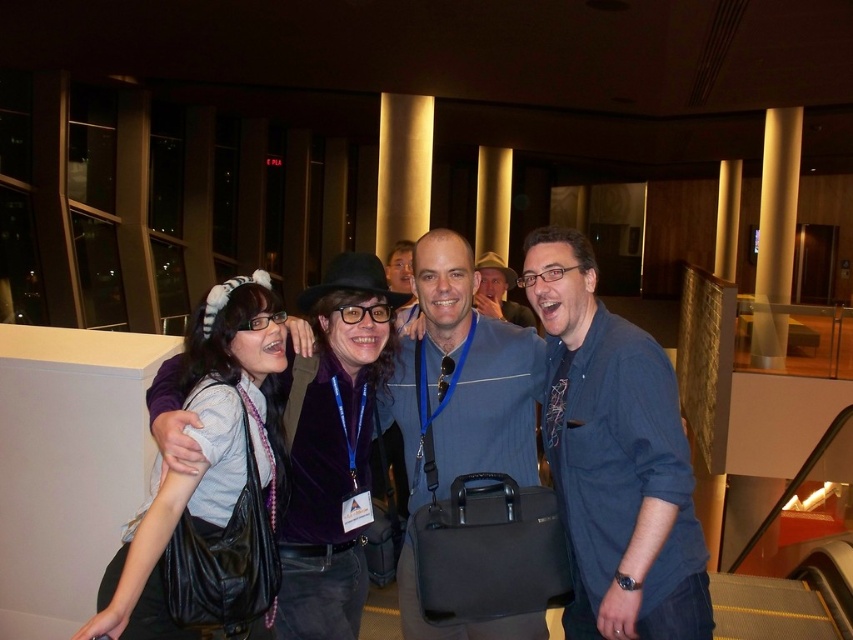
You are organizing a photo shoot and need to ensure that the matte black purse at center and the matte blue shirt at center are visible in the frame. Given their sizes, which object should you prioritize positioning closer to the camera to ensure clarity?

The matte black purse at center has a lesser width compared to the matte blue shirt at center, so you should prioritize positioning the matte black purse at center closer to the camera to ensure its details are clearly visible.

From the picture: You are organizing a small event and need to place two items on a narrow table. You have a matte black purse at center and a black leather bag at center. Which item should you choose to ensure it fits better on the table?

The matte black purse at center occupies less space than the black leather bag at center, so it would fit better on the narrow table.

You are standing in the room and want to move from the point at coordinates (419,618) to the point at (260,372). Which direction should you move to get closer to the second point?

You should move away from the viewer because point (419,618) is closer to you than point (260,372).